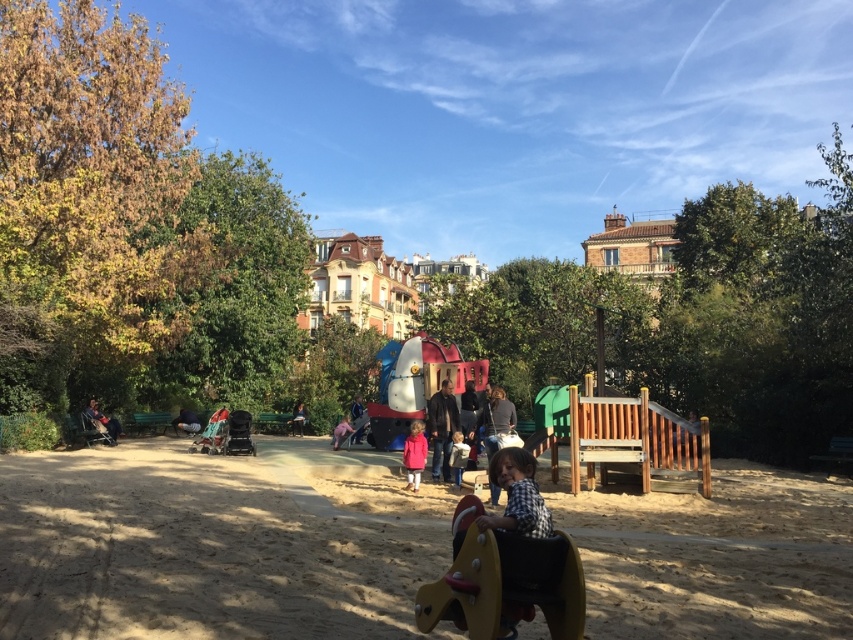
Question: Is matte pink coat at center to the left of dark gray fabric stroller at left from the viewer's perspective?

Choices:
 (A) yes
 (B) no

Answer: (B)

Question: Among these objects, which one is farthest from the camera?

Choices:
 (A) dark gray fabric stroller at left
 (B) dark brown leather jacket at center
 (C) brown sandy playground at center

Answer: (A)

Question: Is dark blue jeans at lower left positioned behind dark gray fabric stroller at left?

Choices:
 (A) yes
 (B) no

Answer: (B)

Question: Which of the following is the closest to the observer?

Choices:
 (A) light brown wooden chair at center
 (B) pink matte jacket at center
 (C) pink fabric person at center
 (D) matte pink coat at center

Answer: (A)

Question: Which is farther from the brown sandy playground at center?

Choices:
 (A) dark brown leather jacket at center
 (B) light brown leather jacket at center
 (C) dark blue jeans at center
 (D) pink fabric person at center

Answer: (C)

Question: Is the position of light brown wooden chair at center more distant than that of dark blue jeans at center?

Choices:
 (A) yes
 (B) no

Answer: (B)